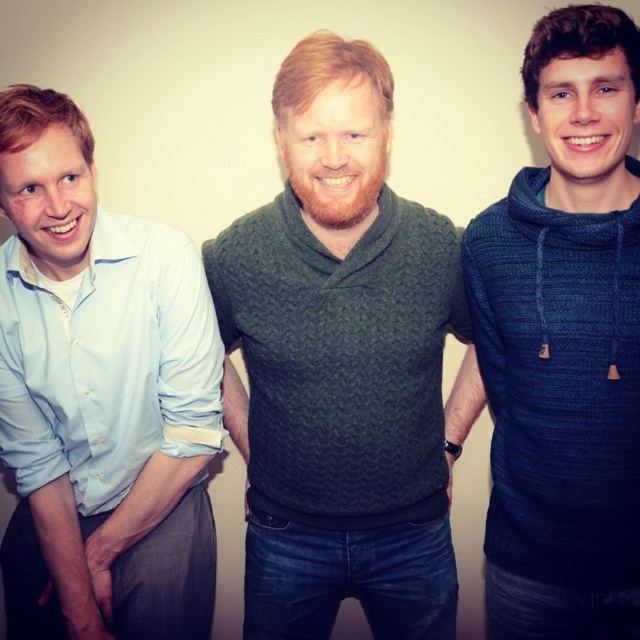
From the picture: You are a photographer setting up for a group photo. You have a camera with a 1.2 meter wide lens. The light blue shirt at left and the dark blue knitted hoodie at center are the main subjects. Can both subjects fit within the camera lens width without moving their positions?

The light blue shirt at left might be wider than dark blue knitted hoodie at center, so it is uncertain if both can fit within the 1.2 meter lens width. The photographer should check the actual distance between them.

You are a photographer trying to capture a portrait of the dark green knitted sweater at center and the light blue shirt at left. Which one is positioned higher in the frame?

The dark green knitted sweater at center is positioned higher in the frame than the light blue shirt at left.

From the picture: You are standing in front of the group of three people. There are two points marked on the wall behind them. The first point is at coordinates point (346, 401) and the second point is at point (550, 221). Which point is closer to you?

Point (550, 221) is closer to you because it is in front of point (346, 401).